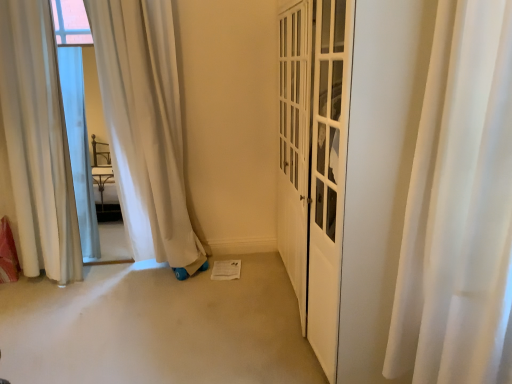
Question: Choose the correct answer: Is white sheer curtain at left, arranged as the 1th curtain when viewed from the back, inside white silky curtain at right, positioned as the second curtain in back-to-front order, or outside it?

Choices:
 (A) outside
 (B) inside

Answer: (A)

Question: Is white sheer curtain at left, placed as the second curtain when sorted from right to left, to the left or to the right of white silky curtain at right, marked as the second curtain in a left-to-right arrangement, in the image?

Choices:
 (A) right
 (B) left

Answer: (B)

Question: Considering the positions of white sheer curtain at left, which is counted as the second curtain, starting from the front, and white silky curtain at right, which is the 1th curtain from front to back, in the image, is white sheer curtain at left, which is counted as the second curtain, starting from the front, taller or shorter than white silky curtain at right, which is the 1th curtain from front to back,?

Choices:
 (A) tall
 (B) short

Answer: (A)

Question: Is white silky curtain at right, marked as the second curtain in a left-to-right arrangement, spatially inside white sheer curtain at left, which is counted as the second curtain, starting from the front, or outside of it?

Choices:
 (A) inside
 (B) outside

Answer: (B)

Question: Is white silky curtain at right, positioned as the second curtain in back-to-front order, taller or shorter than white sheer curtain at left, arranged as the 1th curtain when viewed from the back?

Choices:
 (A) tall
 (B) short

Answer: (B)

Question: Considering their positions, is white silky curtain at right, positioned as the second curtain in back-to-front order, located in front of or behind white sheer curtain at left, acting as the 1th curtain starting from the left?

Choices:
 (A) front
 (B) behind

Answer: (A)

Question: From a real-world perspective, is white silky curtain at right, marked as the second curtain in a left-to-right arrangement, positioned above or below white sheer curtain at left, acting as the 1th curtain starting from the left?

Choices:
 (A) below
 (B) above

Answer: (A)